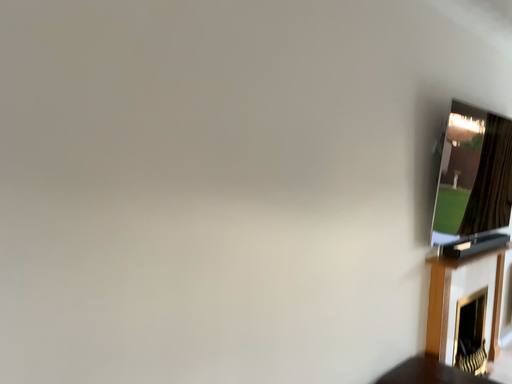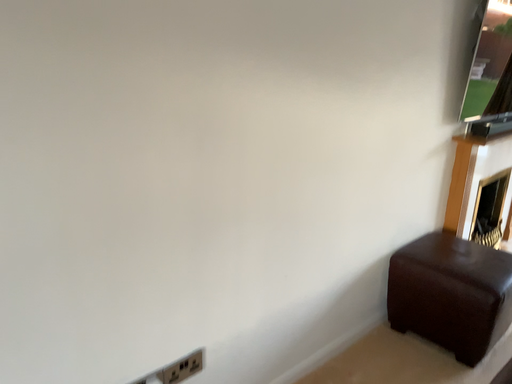
Question: How did the camera likely rotate when shooting the video?

Choices:
 (A) rotated downward
 (B) rotated upward

Answer: (A)